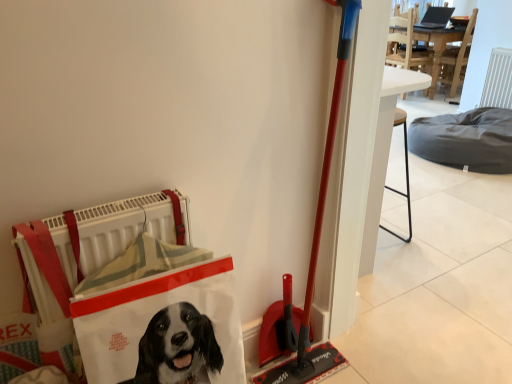
Based on the photo, measure the distance between point (157, 250) and camera.

Point (157, 250) and camera are 1.11 meters apart from each other.

What do you see at coordinates (163, 321) in the screenshot?
I see `white fabric shopping bag at lower left` at bounding box center [163, 321].

Locate an element on the screen. This screenshot has height=384, width=512. white fabric shopping bag at lower left is located at coordinates (163, 321).

Image resolution: width=512 pixels, height=384 pixels. I want to click on dark gray fabric dog bed at center-right, so click(466, 140).

Describe the element at coordinates (466, 140) in the screenshot. I see `dark gray fabric dog bed at center-right` at that location.

Measure the distance between point (x=473, y=118) and camera.

3.39 meters.

The width and height of the screenshot is (512, 384). In order to click on white fabric shopping bag at lower left in this screenshot , I will do `click(163, 321)`.

Would you say dark gray fabric dog bed at center-right is to the left or to the right of white fabric shopping bag at lower left in the picture?

In the image, dark gray fabric dog bed at center-right appears on the right side of white fabric shopping bag at lower left.

Is the depth of dark gray fabric dog bed at center-right less than that of white fabric shopping bag at lower left?

No, dark gray fabric dog bed at center-right is further to the viewer.

Which is less distant, (468, 128) or (195, 304)?

Positioned in front is point (195, 304).

From the image's perspective, would you say dark gray fabric dog bed at center-right is positioned over white fabric shopping bag at lower left?

Yes, from the image's perspective, dark gray fabric dog bed at center-right is on top of white fabric shopping bag at lower left.

Based on the photo, from a real-world perspective, between dark gray fabric dog bed at center-right and white fabric shopping bag at lower left, who is vertically higher?

white fabric shopping bag at lower left.

Looking at their sizes, would you say dark gray fabric dog bed at center-right is wider or thinner than white fabric shopping bag at lower left?

Clearly, dark gray fabric dog bed at center-right has more width compared to white fabric shopping bag at lower left.

From the picture: Between dark gray fabric dog bed at center-right and white fabric shopping bag at lower left, which one has more height?

white fabric shopping bag at lower left.

Can you confirm if dark gray fabric dog bed at center-right is bigger than white fabric shopping bag at lower left?

Yes.

Is dark gray fabric dog bed at center-right situated inside white fabric shopping bag at lower left or outside?

dark gray fabric dog bed at center-right is outside white fabric shopping bag at lower left.

Are dark gray fabric dog bed at center-right and white fabric shopping bag at lower left far apart?

dark gray fabric dog bed at center-right is far away from white fabric shopping bag at lower left.

Is white fabric shopping bag at lower left at the back of dark gray fabric dog bed at center-right?

No, dark gray fabric dog bed at center-right's orientation is not away from white fabric shopping bag at lower left.

How many degrees apart are the facing directions of dark gray fabric dog bed at center-right and white fabric shopping bag at lower left?

The facing directions of dark gray fabric dog bed at center-right and white fabric shopping bag at lower left are 88.1 degrees apart.

How much distance is there between dark gray fabric dog bed at center-right and white fabric shopping bag at lower left?

dark gray fabric dog bed at center-right is 2.78 meters away from white fabric shopping bag at lower left.

Locate an element on the screen. Image resolution: width=512 pixels, height=384 pixels. shopping bag that appears above the dark gray fabric dog bed at center-right (from a real-world perspective) is located at coordinates (163, 321).

Is white fabric shopping bag at lower left at the right side of dark gray fabric dog bed at center-right?

Incorrect, white fabric shopping bag at lower left is not on the right side of dark gray fabric dog bed at center-right.

Considering the positions of objects white fabric shopping bag at lower left and dark gray fabric dog bed at center-right in the image provided, who is behind, white fabric shopping bag at lower left or dark gray fabric dog bed at center-right?

dark gray fabric dog bed at center-right is further away from the camera.

Is point (221, 330) positioned before point (454, 149)?

Yes.

From the image's perspective, between white fabric shopping bag at lower left and dark gray fabric dog bed at center-right, which one is located above?

dark gray fabric dog bed at center-right is shown above in the image.

Looking at this image, from a real-world perspective, which object rests below the other?

dark gray fabric dog bed at center-right.

Considering the relative sizes of white fabric shopping bag at lower left and dark gray fabric dog bed at center-right in the image provided, is white fabric shopping bag at lower left thinner than dark gray fabric dog bed at center-right?

Yes.

Between white fabric shopping bag at lower left and dark gray fabric dog bed at center-right, which one has less height?

dark gray fabric dog bed at center-right.

Does white fabric shopping bag at lower left have a larger size compared to dark gray fabric dog bed at center-right?

No, white fabric shopping bag at lower left is not bigger than dark gray fabric dog bed at center-right.

Could dark gray fabric dog bed at center-right be considered to be inside white fabric shopping bag at lower left?

No, dark gray fabric dog bed at center-right is located outside of white fabric shopping bag at lower left.

Is white fabric shopping bag at lower left positioned far away from dark gray fabric dog bed at center-right?

white fabric shopping bag at lower left is far away from dark gray fabric dog bed at center-right.

Is white fabric shopping bag at lower left aimed at dark gray fabric dog bed at center-right?

No, white fabric shopping bag at lower left is not oriented towards dark gray fabric dog bed at center-right.

How distant is white fabric shopping bag at lower left from dark gray fabric dog bed at center-right?

white fabric shopping bag at lower left is 9.14 feet away from dark gray fabric dog bed at center-right.

Identify the location of shopping bag in front of the dark gray fabric dog bed at center-right. (163, 321).

The height and width of the screenshot is (384, 512). Find the location of `shopping bag on the left of dark gray fabric dog bed at center-right`. shopping bag on the left of dark gray fabric dog bed at center-right is located at coordinates (163, 321).

This screenshot has height=384, width=512. Identify the location of shopping bag above the dark gray fabric dog bed at center-right (from a real-world perspective). (163, 321).